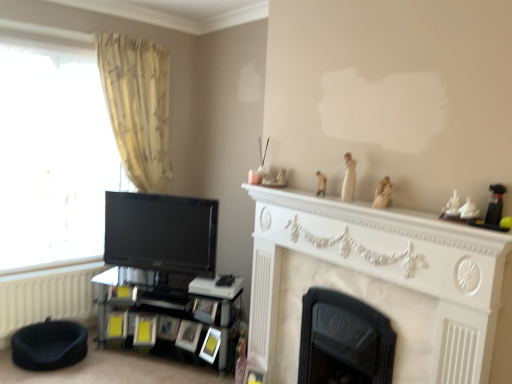
Where is `vacant area in front of white glossy statue at upper center, the second toy viewed from the left`? The width and height of the screenshot is (512, 384). vacant area in front of white glossy statue at upper center, the second toy viewed from the left is located at coordinates (369, 206).